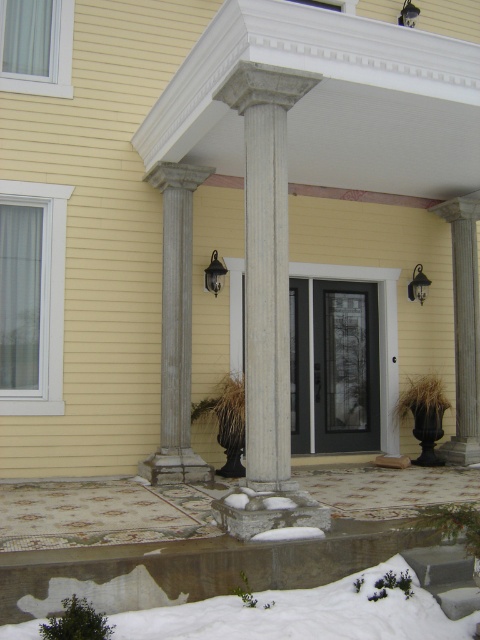
Question: Can you confirm if black matte wall sconce at upper center is wider than metallic black lamp at upper center?

Choices:
 (A) yes
 (B) no

Answer: (B)

Question: Which point appears farthest from the camera in this image?

Choices:
 (A) (419, 300)
 (B) (207, 266)
 (C) (399, 20)
 (D) (169, 470)

Answer: (A)

Question: Among these points, which one is farthest from the camera?

Choices:
 (A) (211, 276)
 (B) (420, 276)
 (C) (176, 384)

Answer: (B)

Question: Does gray stone column at center have a smaller size compared to black matte wall sconce at upper center?

Choices:
 (A) no
 (B) yes

Answer: (A)

Question: Which of the following is the farthest from the observer?

Choices:
 (A) click(x=404, y=1)
 (B) click(x=267, y=468)
 (C) click(x=301, y=589)
 (D) click(x=469, y=248)

Answer: (A)

Question: Can you confirm if white marble column at center is bigger than metallic gray wall sconce at upper right?

Choices:
 (A) yes
 (B) no

Answer: (A)